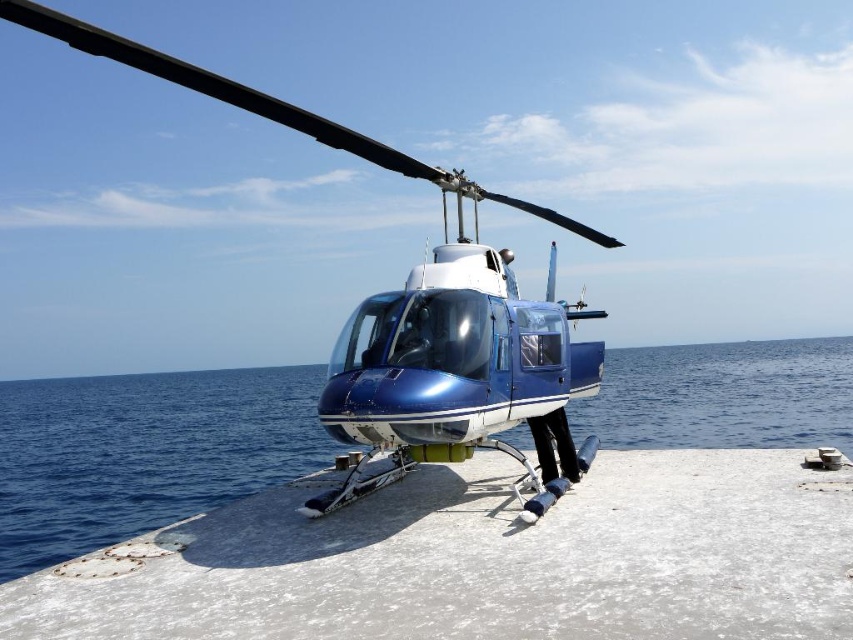
Can you confirm if blue glossy water at center is wider than metallic blue helicopter at center?

Indeed, blue glossy water at center has a greater width compared to metallic blue helicopter at center.

Between blue glossy water at center and metallic blue helicopter at center, which one is positioned lower?

blue glossy water at center is lower down.

Which is behind, point (187, 490) or point (413, 285)?

Point (187, 490)

You are a GUI agent. You are given a task and a screenshot of the screen. Output one action in this format:
    pyautogui.click(x=<x>, y=<y>)
    Task: Click on the blue glossy water at center
    This screenshot has width=853, height=640.
    Given the screenshot: What is the action you would take?
    (x=143, y=452)

Which is more to the right, concrete ledge at center or blue glossy water at center?

From the viewer's perspective, blue glossy water at center appears more on the right side.

Which is behind, point (386, 620) or point (779, 372)?

Point (779, 372)

Is point (669, 564) positioned before point (79, 381)?

Yes, it is.

In order to click on concrete ledge at center in this screenshot , I will do `click(482, 561)`.

Can you confirm if concrete ledge at center is positioned below metallic blue helicopter at center?

Yes.

Identify the location of concrete ledge at center. This screenshot has width=853, height=640. (482, 561).